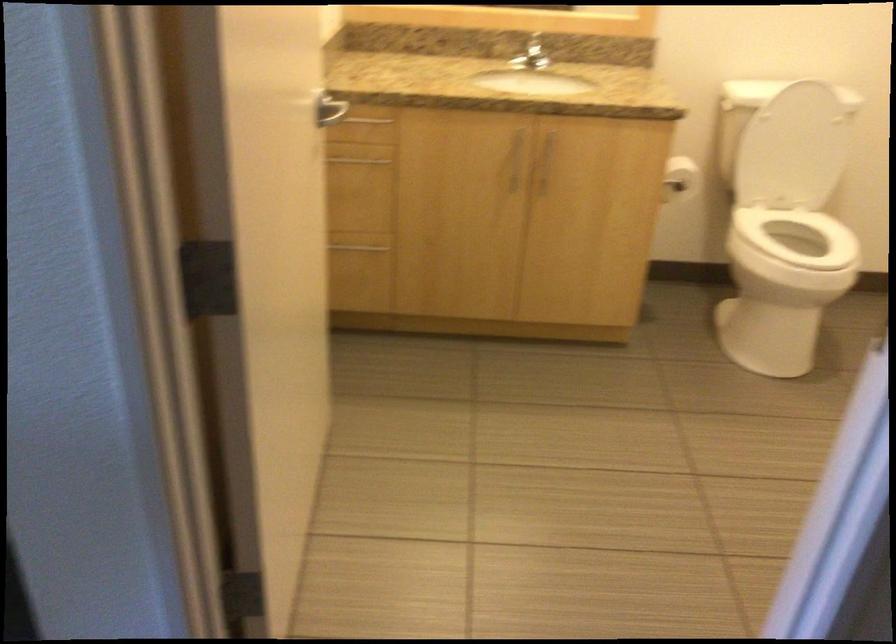
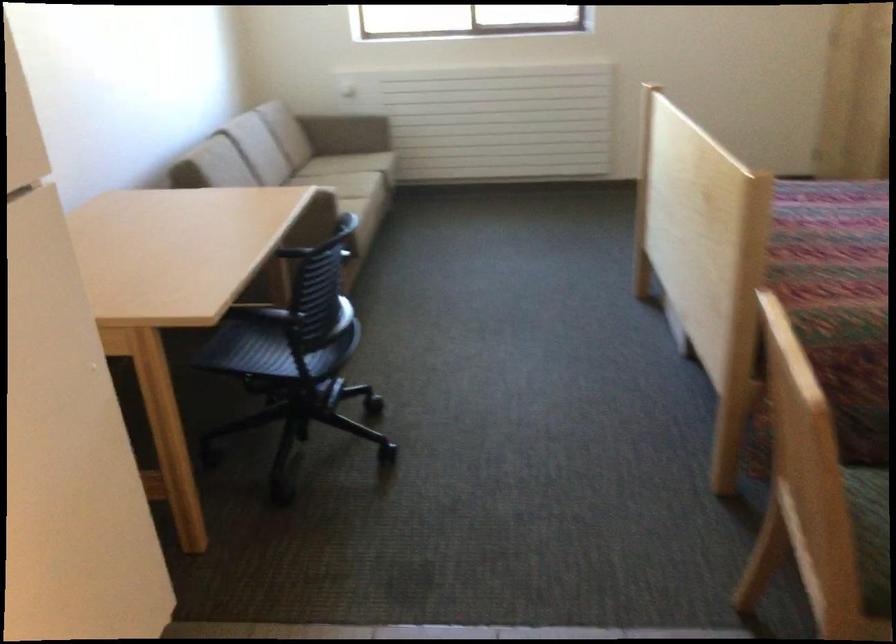
First-person continuous shooting, in which direction is the camera rotating?

The camera rotated toward left-down.